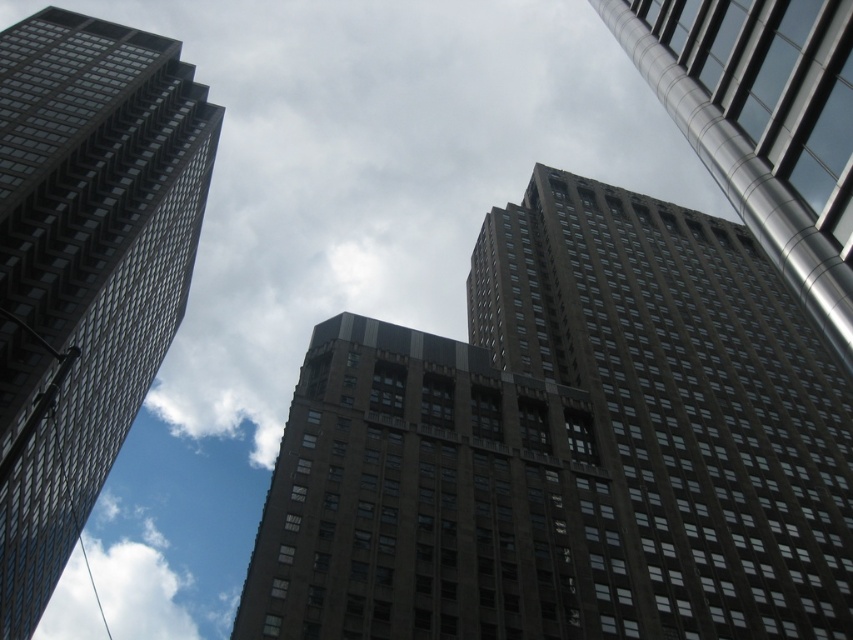
Question: Can you confirm if white fluffy cloud at upper center is positioned above white fluffy cloud at lower left?

Choices:
 (A) yes
 (B) no

Answer: (A)

Question: Does white fluffy cloud at upper center have a lesser width compared to matte glass skyscraper at left?

Choices:
 (A) no
 (B) yes

Answer: (A)

Question: Based on their relative distances, which object is farther from the matte glass skyscraper at left?

Choices:
 (A) brown stone building at upper center
 (B) white fluffy cloud at lower left
 (C) polished silver tower at upper right
 (D) white fluffy cloud at upper center

Answer: (B)

Question: Which point is closer to the camera?

Choices:
 (A) brown stone building at upper center
 (B) matte glass skyscraper at left
 (C) polished silver tower at upper right
 (D) white fluffy cloud at upper center

Answer: (B)

Question: Which object is positioned farthest from the brown stone building at upper center?

Choices:
 (A) white fluffy cloud at upper center
 (B) polished silver tower at upper right

Answer: (A)

Question: Does white fluffy cloud at upper center come behind white fluffy cloud at lower left?

Choices:
 (A) no
 (B) yes

Answer: (A)